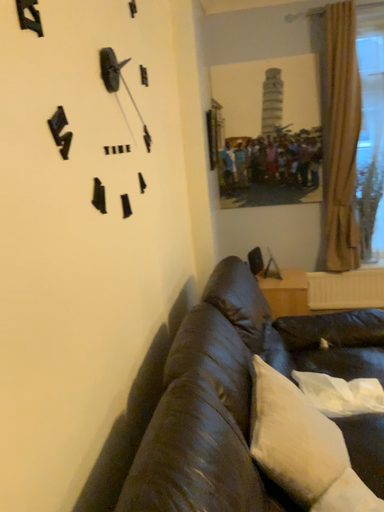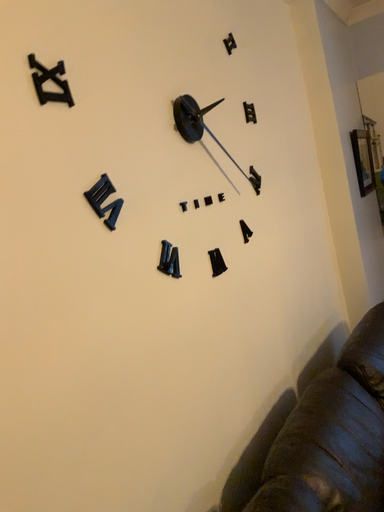
Question: Which way did the camera rotate in the video?

Choices:
 (A) rotated right
 (B) rotated left

Answer: (B)